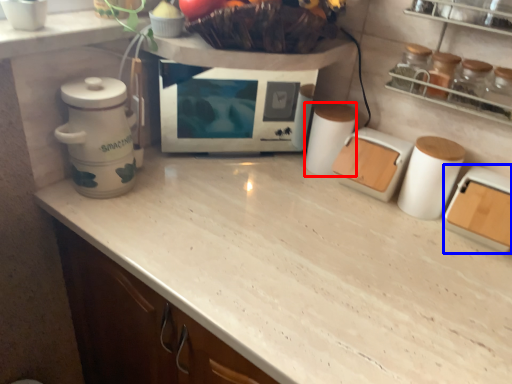
Question: Among these objects, which one is farthest to the camera, appliance (highlighted by a red box) or kitchen appliance (highlighted by a blue box)?

Choices:
 (A) appliance
 (B) kitchen appliance

Answer: (A)